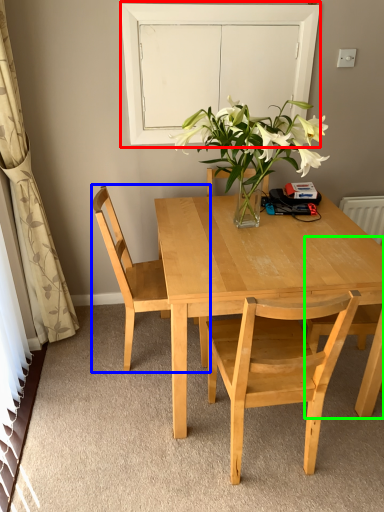
Question: Estimate the real-world distances between objects in this image. Which object is farther from glass door (highlighted by a red box), chair (highlighted by a blue box) or chair (highlighted by a green box)?

Choices:
 (A) chair
 (B) chair

Answer: (B)